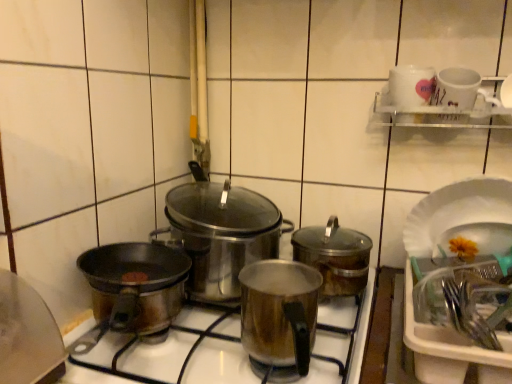
Question: Does satin silver pot at center have a greater height compared to stainless steel pot at center, the first kitchen appliance from the left?

Choices:
 (A) yes
 (B) no

Answer: (B)

Question: Considering the relative positions of satin silver pot at center and stainless steel pot at center, the 3th kitchen appliance positioned from the right, in the image provided, is satin silver pot at center to the left of stainless steel pot at center, the 3th kitchen appliance positioned from the right, from the viewer's perspective?

Choices:
 (A) no
 (B) yes

Answer: (A)

Question: Is the depth of satin silver pot at center less than that of stainless steel pot at center, the 3th kitchen appliance positioned from the right?

Choices:
 (A) yes
 (B) no

Answer: (A)

Question: Does satin silver pot at center appear on the right side of stainless steel pot at center, the first kitchen appliance from the left?

Choices:
 (A) no
 (B) yes

Answer: (B)

Question: Can you confirm if satin silver pot at center is shorter than stainless steel pot at center, the first kitchen appliance from the left?

Choices:
 (A) yes
 (B) no

Answer: (A)

Question: In the image, is satin silver pot at center positioned in front of or behind white glossy mug at upper right?

Choices:
 (A) front
 (B) behind

Answer: (A)

Question: Considering the positions of satin silver pot at center and white glossy mug at upper right in the image, is satin silver pot at center wider or thinner than white glossy mug at upper right?

Choices:
 (A) thin
 (B) wide

Answer: (B)

Question: From the image's perspective, is satin silver pot at center positioned above or below white glossy mug at upper right?

Choices:
 (A) above
 (B) below

Answer: (B)

Question: Choose the correct answer: Is satin silver pot at center inside white glossy mug at upper right or outside it?

Choices:
 (A) outside
 (B) inside

Answer: (A)

Question: From a real-world perspective, is satin silver pot at center physically located above or below stainless steel pot at center, the first kitchen appliance from the left?

Choices:
 (A) above
 (B) below

Answer: (B)

Question: Would you say satin silver pot at center is inside or outside stainless steel pot at center, the first kitchen appliance from the left?

Choices:
 (A) inside
 (B) outside

Answer: (B)

Question: Is satin silver pot at center bigger or smaller than stainless steel pot at center, the first kitchen appliance from the left?

Choices:
 (A) small
 (B) big

Answer: (B)

Question: In terms of width, does satin silver pot at center look wider or thinner when compared to stainless steel pot at center, the 3th kitchen appliance positioned from the right?

Choices:
 (A) wide
 (B) thin

Answer: (A)

Question: Is point (362, 258) positioned closer to the camera than point (300, 301)?

Choices:
 (A) closer
 (B) farther

Answer: (B)

Question: Is shiny metallic pot at center, which is counted as the 3th kitchen appliance, starting from the left, in front of or behind shiny metallic pot at center, positioned as the second kitchen appliance in left-to-right order, in the image?

Choices:
 (A) front
 (B) behind

Answer: (B)